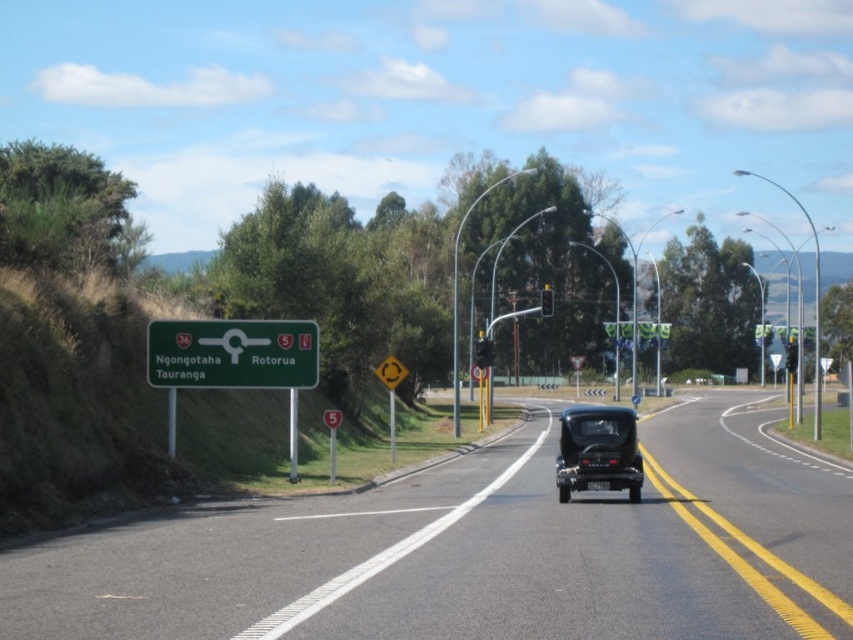
Question: Is black asphalt road at center thinner than green matte sign at left?

Choices:
 (A) yes
 (B) no

Answer: (B)

Question: Which object is the farthest from the green matte sign at left?

Choices:
 (A) shiny black car at center
 (B) black asphalt road at center

Answer: (A)

Question: Estimate the real-world distances between objects in this image. Which object is farther from the green matte sign at left?

Choices:
 (A) black asphalt road at center
 (B) shiny black car at center

Answer: (B)

Question: Is green matte sign at left above shiny black car at center?

Choices:
 (A) no
 (B) yes

Answer: (B)

Question: Which object is farther from the camera taking this photo?

Choices:
 (A) black asphalt road at center
 (B) green matte sign at left
 (C) shiny black car at center

Answer: (B)

Question: Is black asphalt road at center below shiny black car at center?

Choices:
 (A) no
 (B) yes

Answer: (B)